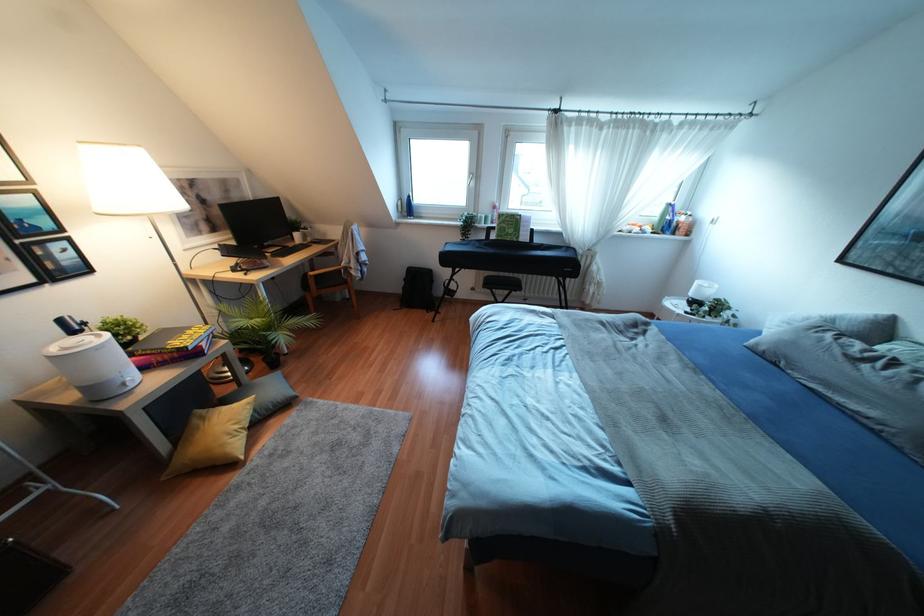
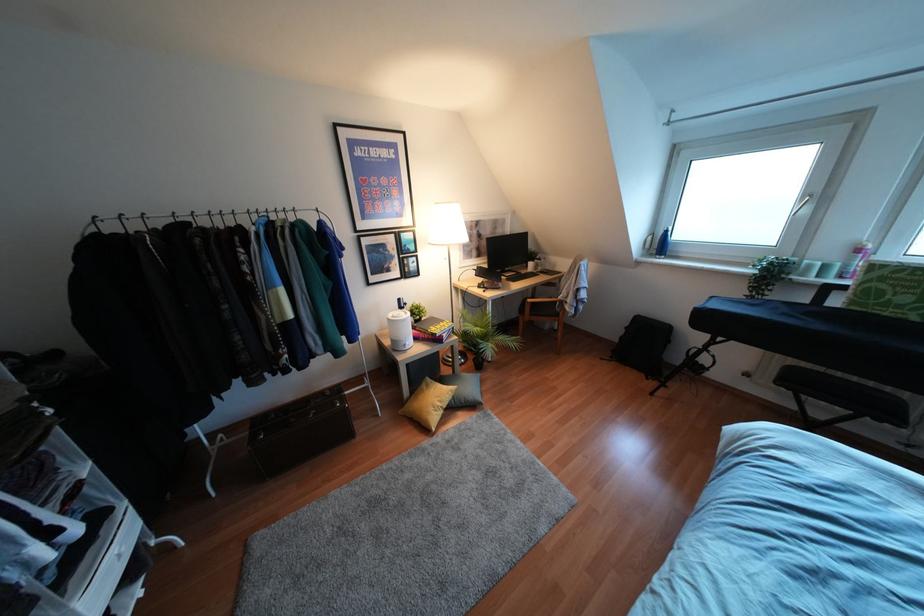
Question: How did the camera likely rotate?

Choices:
 (A) Left
 (B) Right
 (C) Up
 (D) Down

Answer: (A)